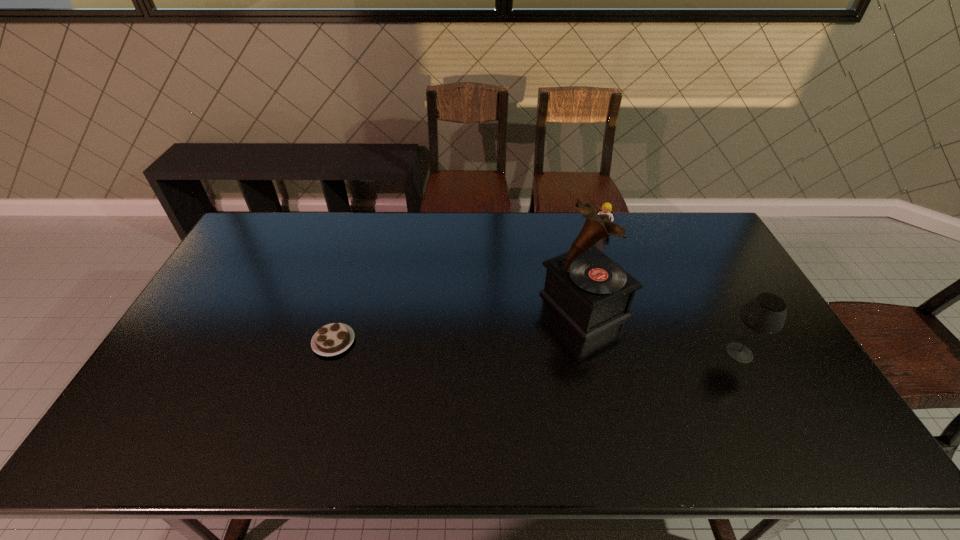
I want to click on vacant space located on the front-facing side of the farthest object, so click(x=589, y=283).

What are the coordinates of `vacant area situated 0.090m on the front-facing side of the farthest object` in the screenshot? It's located at (596, 249).

Identify the location of free space located 0.340m at the horn opening of the tallest object. This screenshot has width=960, height=540. (447, 370).

This screenshot has height=540, width=960. I want to click on free space located 0.200m at the horn opening of the tallest object, so click(x=492, y=350).

This screenshot has height=540, width=960. What are the coordinates of `vacant space situated at the horn opening of the tallest object` in the screenshot? It's located at (527, 333).

Where is `object positioned at the far edge`? The image size is (960, 540). object positioned at the far edge is located at coordinates (606, 208).

Image resolution: width=960 pixels, height=540 pixels. I want to click on object at the right edge, so click(765, 313).

At what (x,y) coordinates should I click in order to perform the action: click on free space at the far edge. Please return your answer as a coordinate pair (x, y). The height and width of the screenshot is (540, 960). Looking at the image, I should click on (436, 237).

You are a GUI agent. You are given a task and a screenshot of the screen. Output one action in this format:
    pyautogui.click(x=<x>, y=<y>)
    Task: Click on the blank space at the near edge
    
    Given the screenshot: What is the action you would take?
    pyautogui.click(x=598, y=406)

This screenshot has width=960, height=540. In the image, there is a desktop. What are the coordinates of `vacant area at the left edge` in the screenshot? It's located at (210, 380).